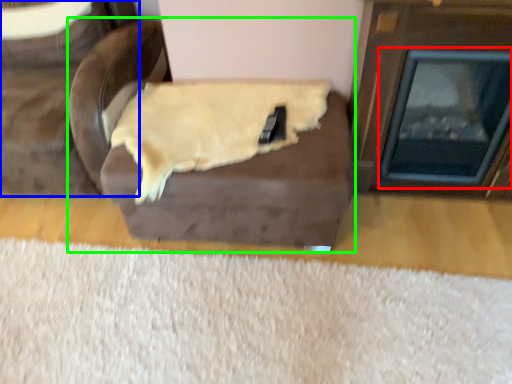
Question: Which is nearer to the fireplace (highlighted by a red box)? furniture (highlighted by a blue box) or furniture (highlighted by a green box).

Choices:
 (A) furniture
 (B) furniture

Answer: (B)